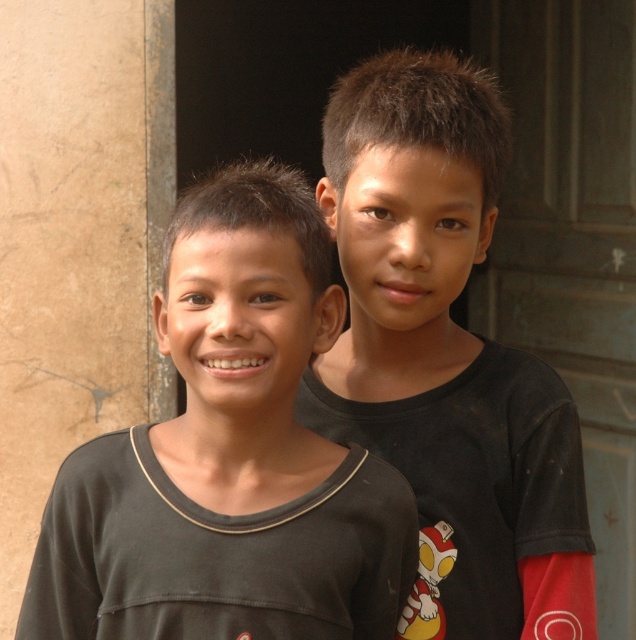
You are a GUI agent. You are given a task and a screenshot of the screen. Output one action in this format:
    pyautogui.click(x=<x>, y=<y>)
    Task: Click on the dark gray shirt at left
    
    Given the screenshot: What is the action you would take?
    pyautogui.click(x=230, y=456)

The height and width of the screenshot is (640, 636). What do you see at coordinates (230, 456) in the screenshot? I see `dark gray shirt at left` at bounding box center [230, 456].

The image size is (636, 640). What do you see at coordinates (230, 456) in the screenshot?
I see `dark gray shirt at left` at bounding box center [230, 456].

The height and width of the screenshot is (640, 636). What are the coordinates of `dark gray shirt at left` in the screenshot? It's located at (230, 456).